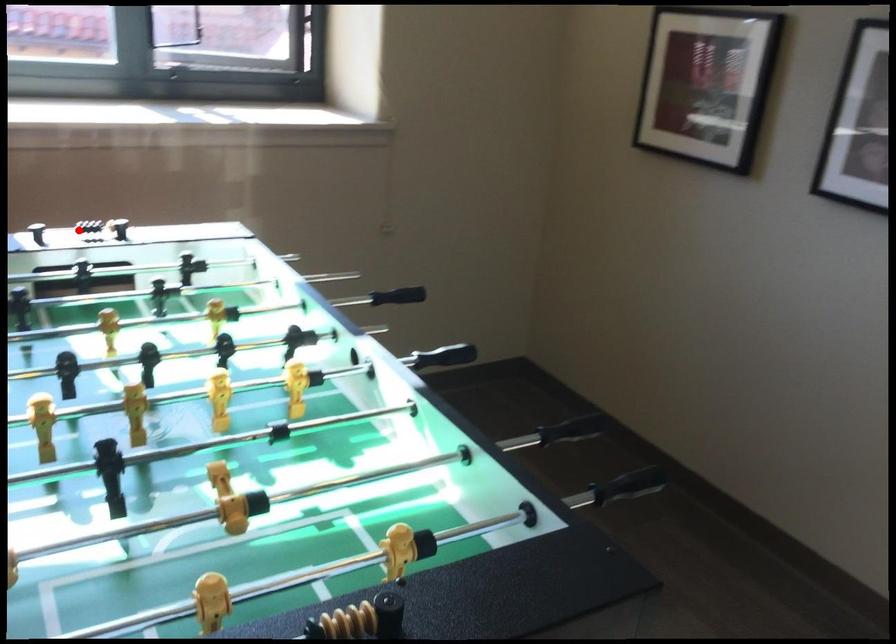
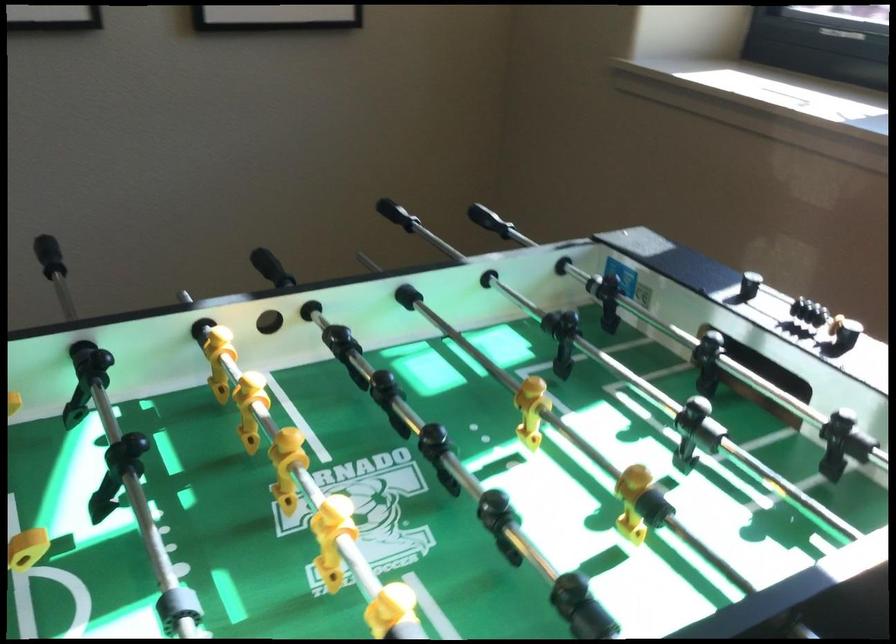
Question: A red point is marked in image1. In image2, is the corresponding 3D point closer to the camera or farther? Reply with the corresponding letter.

Choices:
 (A) The corresponding 3D point is closer.
 (B) The corresponding 3D point is farther.

Answer: (A)